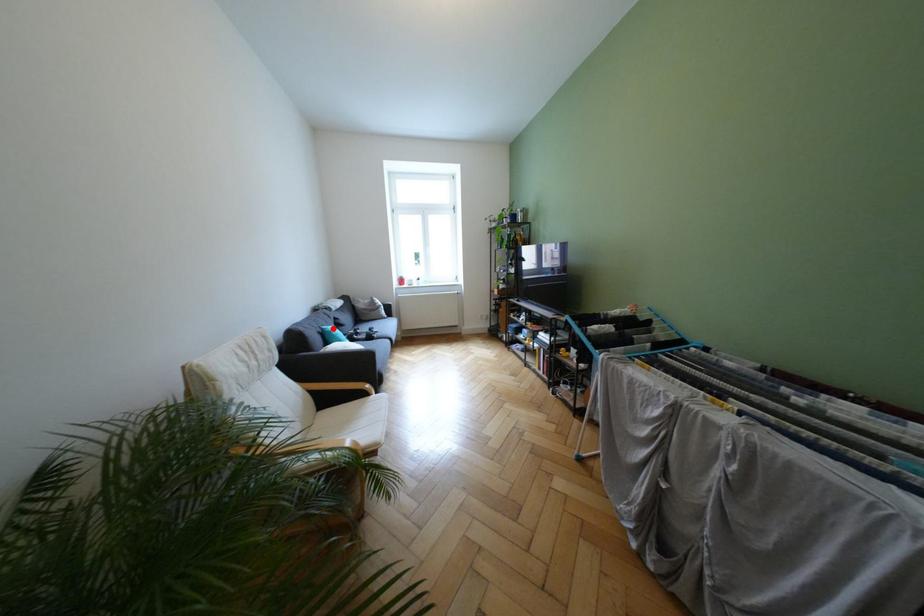
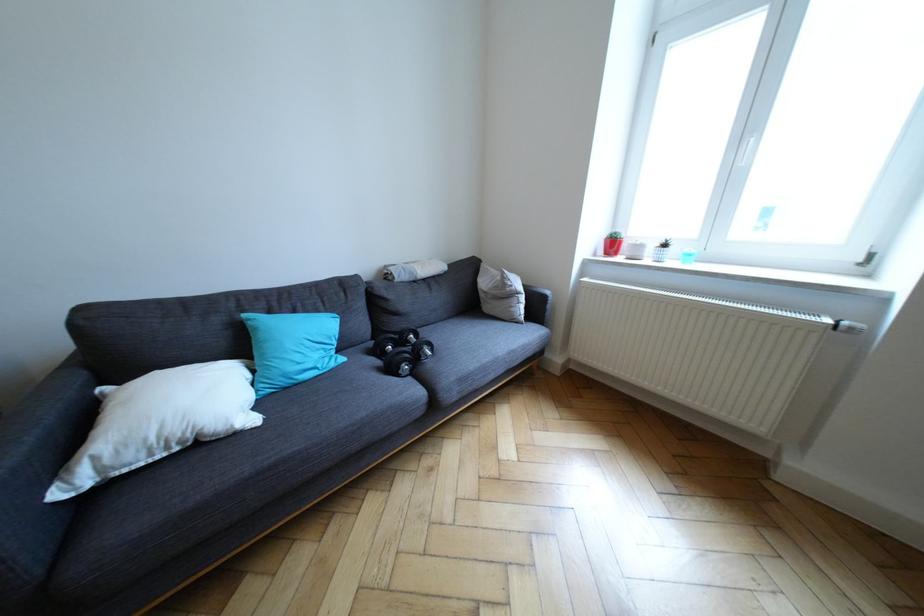
Question: I am providing you with two images of the same scene from different viewpoints. Image1 has a red point marked. In image2, the corresponding 3D location appears at what relative position? Reply with the corresponding letter.

Choices:
 (A) Closer
 (B) Farther

Answer: (B)